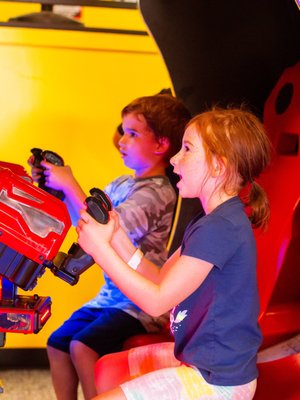
Locate an element on the screen. This screenshot has height=400, width=300. seats is located at coordinates (273, 245), (277, 376).